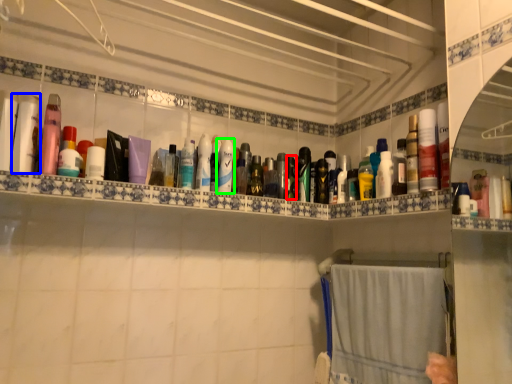
Question: Considering the real-world distances, which object is closest to toiletry (highlighted by a red box)? toiletry (highlighted by a blue box) or toiletry (highlighted by a green box).

Choices:
 (A) toiletry
 (B) toiletry

Answer: (B)